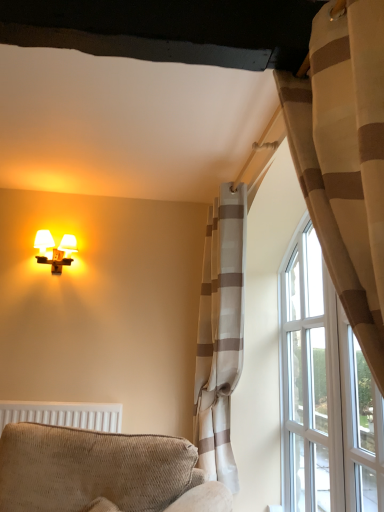
This screenshot has height=512, width=384. What do you see at coordinates (54, 250) in the screenshot?
I see `matte white wall sconce at upper left` at bounding box center [54, 250].

Find the location of a particular element. This screenshot has width=384, height=512. white textured radiator at lower left is located at coordinates (64, 415).

Measure the distance between white glass window at upper right and camera.

They are 1.36 meters apart.

This screenshot has width=384, height=512. What do you see at coordinates (324, 393) in the screenshot?
I see `white glass window at upper right` at bounding box center [324, 393].

Image resolution: width=384 pixels, height=512 pixels. What are the coordinates of `beige striped curtain at right, arranged as the first curtain when viewed from the front` in the screenshot? It's located at (345, 159).

In order to click on glass door that is above the white textured radiator at lower left (from the image's perspective) in this screenshot , I will do `click(360, 425)`.

Considering the relative sizes of white textured radiator at lower left and clear glass door at right in the image provided, is white textured radiator at lower left shorter than clear glass door at right?

Yes.

Is white textured radiator at lower left to the left of clear glass door at right from the viewer's perspective?

Yes.

Is clear glass door at right surrounded by white textured radiator at lower left?

No.

Considering the positions of points (347, 499) and (86, 424), is point (347, 499) farther from camera compared to point (86, 424)?

No, (347, 499) is closer to viewer.

The height and width of the screenshot is (512, 384). I want to click on radiator that appears below the clear glass door at right (from a real-world perspective), so click(64, 415).

From a real-world perspective, is clear glass door at right on top of white textured radiator at lower left?

Yes, from a real-world perspective, clear glass door at right is on top of white textured radiator at lower left.

Can you confirm if clear glass door at right is thinner than white textured radiator at lower left?

Yes, clear glass door at right is thinner than white textured radiator at lower left.

From a real-world perspective, is clear glass door at right positioned over beige striped curtain at right, arranged as the second curtain when viewed from the back, based on gravity?

Actually, clear glass door at right is physically below beige striped curtain at right, arranged as the second curtain when viewed from the back, in the real world.

Are clear glass door at right and beige striped curtain at right, arranged as the second curtain when viewed from the back, located far from each other?

clear glass door at right is positioned a significant distance from beige striped curtain at right, arranged as the second curtain when viewed from the back.

Looking at this image, is clear glass door at right bigger or smaller than beige striped curtain at right, arranged as the second curtain when viewed from the back?

Considering their sizes, clear glass door at right takes up less space than beige striped curtain at right, arranged as the second curtain when viewed from the back.

Between clear glass door at right and beige striped curtain at right, arranged as the second curtain when viewed from the back, which one is positioned in front?

beige striped curtain at right, arranged as the second curtain when viewed from the back, is more forward.

Considering the points (371, 81) and (291, 377), which point is in front, point (371, 81) or point (291, 377)?

The point (371, 81) is closer to the camera.

Does beige striped curtain at right, arranged as the second curtain when viewed from the back, have a greater width compared to white glass window at upper right?

Yes.

From a real-world perspective, which is physically above, beige striped curtain at right, arranged as the first curtain when viewed from the front, or white glass window at upper right?

beige striped curtain at right, arranged as the first curtain when viewed from the front.

Is beige striped curtain at right, arranged as the first curtain when viewed from the front, at the left side of white glass window at upper right?

Yes, beige striped curtain at right, arranged as the first curtain when viewed from the front, is to the left of white glass window at upper right.

Visually, is light beige striped curtain at upper right, which is the 1th curtain in back-to-front order, positioned to the left or to the right of beige striped curtain at right, arranged as the second curtain when viewed from the back?

Based on their positions, light beige striped curtain at upper right, which is the 1th curtain in back-to-front order, is located to the left of beige striped curtain at right, arranged as the second curtain when viewed from the back.

From a real-world perspective, between light beige striped curtain at upper right, which is the 2th curtain in front-to-back order, and beige striped curtain at right, arranged as the first curtain when viewed from the front, who is vertically higher?

beige striped curtain at right, arranged as the first curtain when viewed from the front, is physically above.

Can you tell me how much light beige striped curtain at upper right, which is the 2th curtain in front-to-back order, and beige striped curtain at right, arranged as the first curtain when viewed from the front, differ in facing direction?

The angular difference between light beige striped curtain at upper right, which is the 2th curtain in front-to-back order, and beige striped curtain at right, arranged as the first curtain when viewed from the front, is 0.00402 degrees.

You are a GUI agent. You are given a task and a screenshot of the screen. Output one action in this format:
    pyautogui.click(x=<x>, y=<y>)
    Task: Click on the curtain below the beige striped curtain at right, arranged as the first curtain when viewed from the front (from the image's perspective)
    The height and width of the screenshot is (512, 384).
    Given the screenshot: What is the action you would take?
    pyautogui.click(x=220, y=333)

Is white textured radiator at lower left a part of white glass window at upper right?

No, white textured radiator at lower left is not inside white glass window at upper right.

From the image's perspective, is white glass window at upper right on top of white textured radiator at lower left?

Yes, from the image's perspective, white glass window at upper right is above white textured radiator at lower left.

From a real-world perspective, does white glass window at upper right stand above white textured radiator at lower left?

Yes, from a real-world perspective, white glass window at upper right is on top of white textured radiator at lower left.

Is white glass window at upper right at the left side of white textured radiator at lower left?

No, white glass window at upper right is not to the left of white textured radiator at lower left.

Does point (299, 162) appear closer or farther from the camera than point (210, 438)?

Point (299, 162) is positioned closer to the camera compared to point (210, 438).

Is beige striped curtain at right, arranged as the second curtain when viewed from the back, taller than light beige striped curtain at upper right, which is the 2th curtain in front-to-back order?

No.

From a real-world perspective, which object stands above the other?

beige striped curtain at right, arranged as the second curtain when viewed from the back.

Is beige striped curtain at right, arranged as the first curtain when viewed from the front, spatially inside light beige striped curtain at upper right, which is the 2th curtain in front-to-back order, or outside of it?

beige striped curtain at right, arranged as the first curtain when viewed from the front, is not inside light beige striped curtain at upper right, which is the 2th curtain in front-to-back order, it's outside.

You are a GUI agent. You are given a task and a screenshot of the screen. Output one action in this format:
    pyautogui.click(x=<x>, y=<y>)
    Task: Click on the glass door above the white textured radiator at lower left (from the image's perspective)
    This screenshot has height=512, width=384.
    Given the screenshot: What is the action you would take?
    pyautogui.click(x=360, y=425)

Locate an element on the screen. This screenshot has height=512, width=384. glass door on the right of white textured radiator at lower left is located at coordinates (360, 425).

Looking at the image, which one is located closer to white textured radiator at lower left, textured beige armchair at lower left or matte white wall sconce at upper left?

matte white wall sconce at upper left lies closer to white textured radiator at lower left than the other object.

When comparing their distances from white textured radiator at lower left, does textured beige armchair at lower left or white glass window at upper right seem further?

white glass window at upper right.

Which object lies further to the anchor point textured beige armchair at lower left, white textured radiator at lower left or beige striped curtain at right, arranged as the second curtain when viewed from the back?

Among the two, beige striped curtain at right, arranged as the second curtain when viewed from the back, is located further to textured beige armchair at lower left.

Which object lies nearer to the anchor point beige striped curtain at right, arranged as the second curtain when viewed from the back, textured beige armchair at lower left or white textured radiator at lower left?

Based on the image, textured beige armchair at lower left appears to be nearer to beige striped curtain at right, arranged as the second curtain when viewed from the back.

Looking at the image, which one is located closer to white glass window at upper right, clear glass door at right or matte white wall sconce at upper left?

Among the two, clear glass door at right is located nearer to white glass window at upper right.

When comparing their distances from light beige striped curtain at upper right, which is the 2th curtain in front-to-back order, does beige striped curtain at right, arranged as the second curtain when viewed from the back, or white glass window at upper right seem further?

The object further to light beige striped curtain at upper right, which is the 2th curtain in front-to-back order, is beige striped curtain at right, arranged as the second curtain when viewed from the back.

Looking at the image, which one is located closer to matte white wall sconce at upper left, light beige striped curtain at upper right, which is the 2th curtain in front-to-back order, or white glass window at upper right?

The object closer to matte white wall sconce at upper left is light beige striped curtain at upper right, which is the 2th curtain in front-to-back order.

Considering their positions, is beige striped curtain at right, arranged as the second curtain when viewed from the back, positioned closer to light beige striped curtain at upper right, which is the 1th curtain in back-to-front order, than clear glass door at right?

clear glass door at right lies closer to light beige striped curtain at upper right, which is the 1th curtain in back-to-front order, than the other object.

The image size is (384, 512). I want to click on glass door between beige striped curtain at right, arranged as the first curtain when viewed from the front, and matte white wall sconce at upper left in the front-back direction, so click(x=360, y=425).

Where is `window between matte white wall sconce at upper left and clear glass door at right in the horizontal direction`? window between matte white wall sconce at upper left and clear glass door at right in the horizontal direction is located at coordinates (324, 393).

Locate an element on the screen. The height and width of the screenshot is (512, 384). window located between beige striped curtain at right, arranged as the second curtain when viewed from the back, and white textured radiator at lower left in the depth direction is located at coordinates (324, 393).

You are a GUI agent. You are given a task and a screenshot of the screen. Output one action in this format:
    pyautogui.click(x=<x>, y=<y>)
    Task: Click on the glass door located between beige striped curtain at right, arranged as the first curtain when viewed from the front, and white textured radiator at lower left in the depth direction
    The width and height of the screenshot is (384, 512).
    Given the screenshot: What is the action you would take?
    360,425